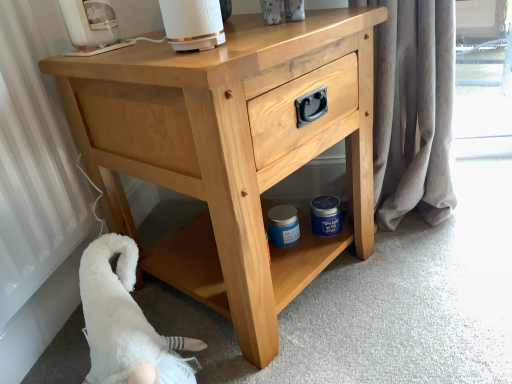
Identify the location of natural wood chest of drawers at center. (230, 152).

The width and height of the screenshot is (512, 384). Describe the element at coordinates (230, 152) in the screenshot. I see `natural wood chest of drawers at center` at that location.

Where is `natural wood chest of drawers at center`? This screenshot has height=384, width=512. natural wood chest of drawers at center is located at coordinates pyautogui.click(x=230, y=152).